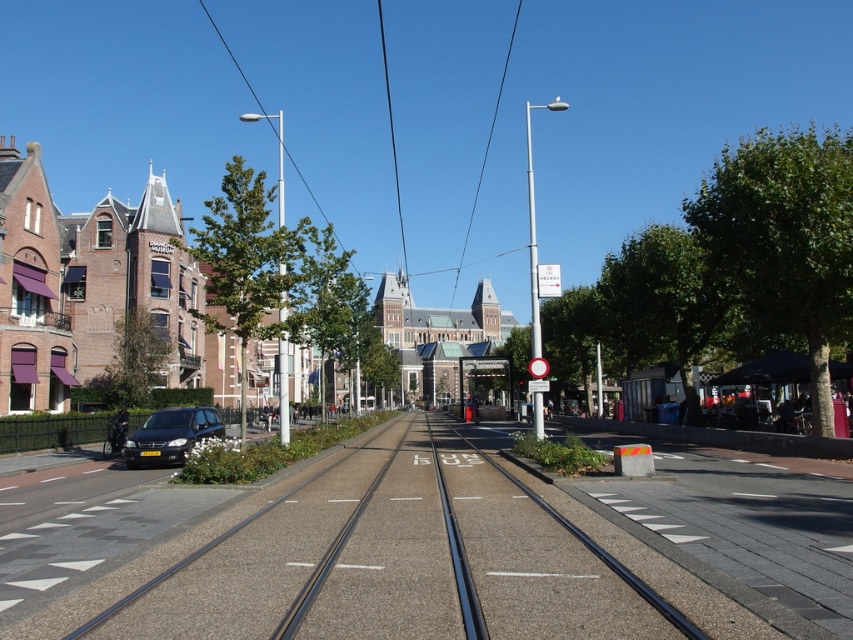
Question: Which of the following is the farthest from the observer?

Choices:
 (A) black asphalt track at center
 (B) satin black car at lower left

Answer: (B)

Question: Which of the following is the closest to the observer?

Choices:
 (A) (544, 556)
 (B) (199, 406)

Answer: (A)

Question: Does black asphalt track at center appear under satin black car at lower left?

Choices:
 (A) no
 (B) yes

Answer: (B)

Question: Does black asphalt track at center have a greater width compared to satin black car at lower left?

Choices:
 (A) no
 (B) yes

Answer: (B)

Question: Considering the relative positions of black asphalt track at center and satin black car at lower left in the image provided, where is black asphalt track at center located with respect to satin black car at lower left?

Choices:
 (A) above
 (B) below

Answer: (B)